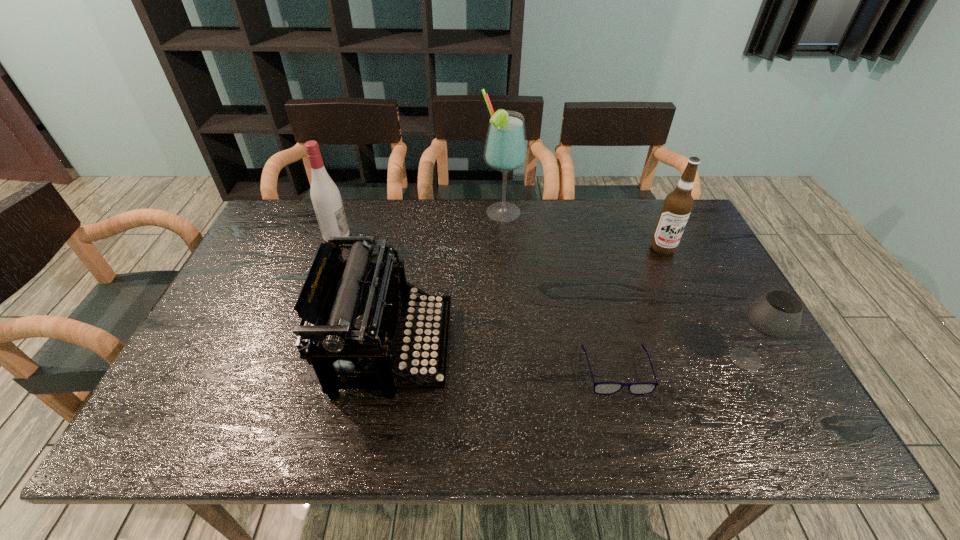
At what (x,y) coordinates should I click in order to perform the action: click on free space between the rightmost alcohol and the fifth tallest object. Please return your answer as a coordinate pair (x, y). This screenshot has height=540, width=960. Looking at the image, I should click on (704, 303).

Locate an element on the screen. blank region between the shortest object and the leftmost alcohol is located at coordinates (476, 302).

Where is `free space between the leftmost object and the spectacles`? free space between the leftmost object and the spectacles is located at coordinates (476, 302).

At what (x,y) coordinates should I click in order to perform the action: click on empty space that is in between the third shortest object and the farthest alcohol. Please return your answer as a coordinate pair (x, y). The width and height of the screenshot is (960, 540). Looking at the image, I should click on (447, 280).

The image size is (960, 540). I want to click on object that stands as the closest to the rightmost alcohol, so click(x=777, y=314).

Locate which object is the second closest to the wineglass. Please provide its 2D coordinates. Your answer should be formatted as a tuple, i.e. [(x, y)], where the tuple contains the x and y coordinates of a point satisfying the conditions above.

[(678, 204)]

The height and width of the screenshot is (540, 960). I want to click on alcohol that stands as the second closest to the rightmost alcohol, so click(325, 196).

Identify which alcohol is the nearest to the tallest alcohol. Please provide its 2D coordinates. Your answer should be formatted as a tuple, i.e. [(x, y)], where the tuple contains the x and y coordinates of a point satisfying the conditions above.

[(678, 204)]

What are the coordinates of `blank space that satisfies the following two spatial constraints: 1. on the typing side of the wineglass; 2. on the right side of the fourth tallest object` in the screenshot? It's located at (390, 359).

This screenshot has height=540, width=960. What are the coordinates of `vacant space that satisfies the following two spatial constraints: 1. on the typing side of the fifth tallest object; 2. on the right side of the typewriter` in the screenshot? It's located at (390, 359).